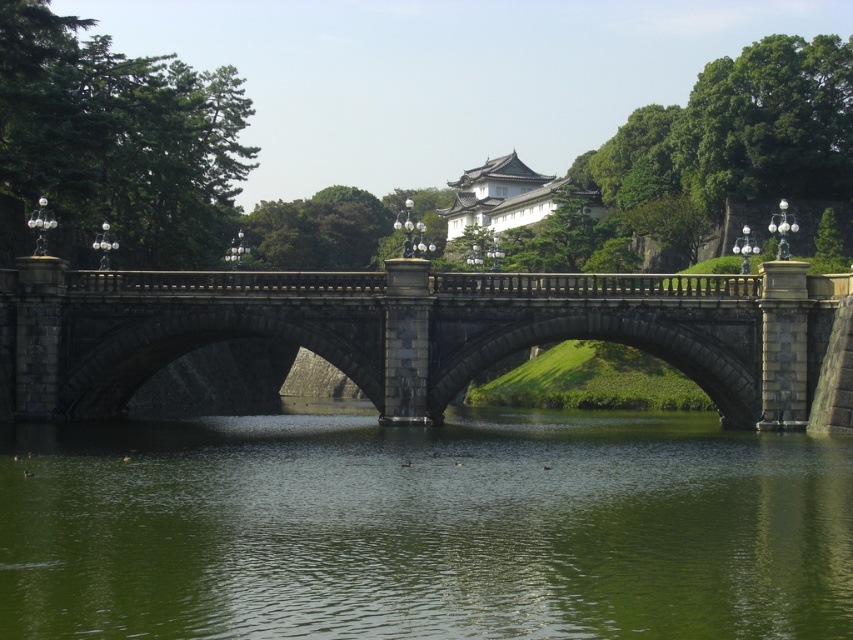
Question: Is green smooth water at center in front of dark gray stone bridge at center?

Choices:
 (A) no
 (B) yes

Answer: (B)

Question: Can you confirm if green smooth water at center is positioned below dark gray stone bridge at center?

Choices:
 (A) no
 (B) yes

Answer: (B)

Question: Is green smooth water at center to the right of dark gray stone bridge at center from the viewer's perspective?

Choices:
 (A) yes
 (B) no

Answer: (A)

Question: Which of the following is the farthest from the observer?

Choices:
 (A) (299, 280)
 (B) (351, 618)

Answer: (A)